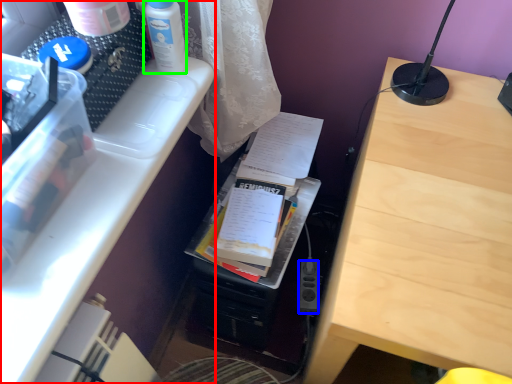
Question: Based on their relative distances, which object is farther from desk (highlighted by a red box)? Choose from power plugs and sockets (highlighted by a blue box) and bottle (highlighted by a green box).

Choices:
 (A) power plugs and sockets
 (B) bottle

Answer: (A)